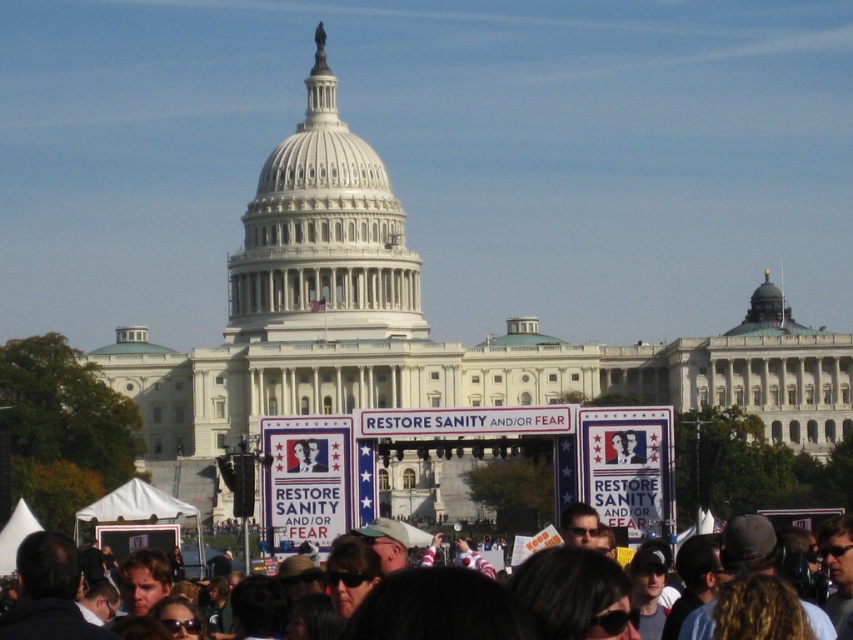
You are a photographer standing in the crowd at the rally in front of the Capitol. You want to take a photo of both the point at coordinates point (346, 513) and the point at coordinates point (724, 547). Which point should you focus on first to ensure both are in the frame?

You should focus on point (346, 513) first because it is closer to you than point (724, 547), which is further away. This way, both points will be within the camera frame.

You are standing in front of the United States Capitol and want to locate the blue fabric sign at center. According to the coordinates provided, where should you look?

The blue fabric sign at center is located at point (628, 467).